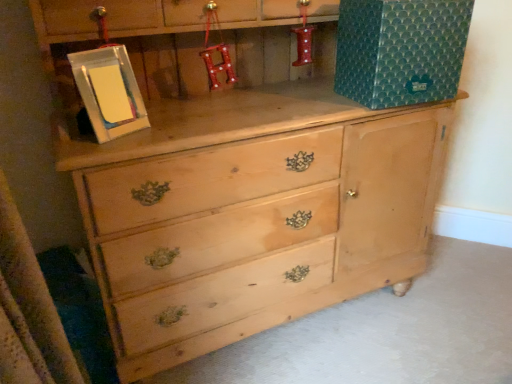
Measure the distance between teal textured box at upper right and camera.

teal textured box at upper right is 1.08 meters from camera.

Describe the element at coordinates (400, 50) in the screenshot. The image size is (512, 384). I see `teal textured box at upper right` at that location.

Locate an element on the screen. This screenshot has width=512, height=384. teal textured box at upper right is located at coordinates (400, 50).

Identify the location of teal textured box at upper right. (400, 50).